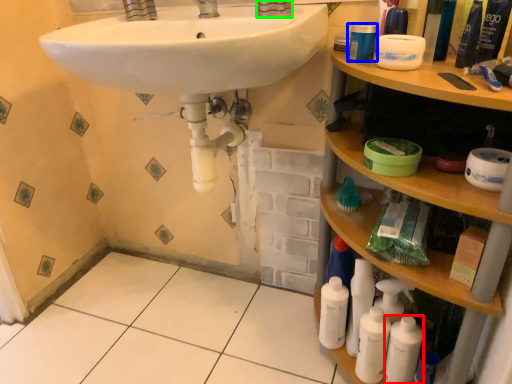
Question: Considering the real-world distances, which object is farthest from mouthwash (highlighted by a red box)? mouthwash (highlighted by a blue box) or faucet (highlighted by a green box)?

Choices:
 (A) mouthwash
 (B) faucet

Answer: (B)